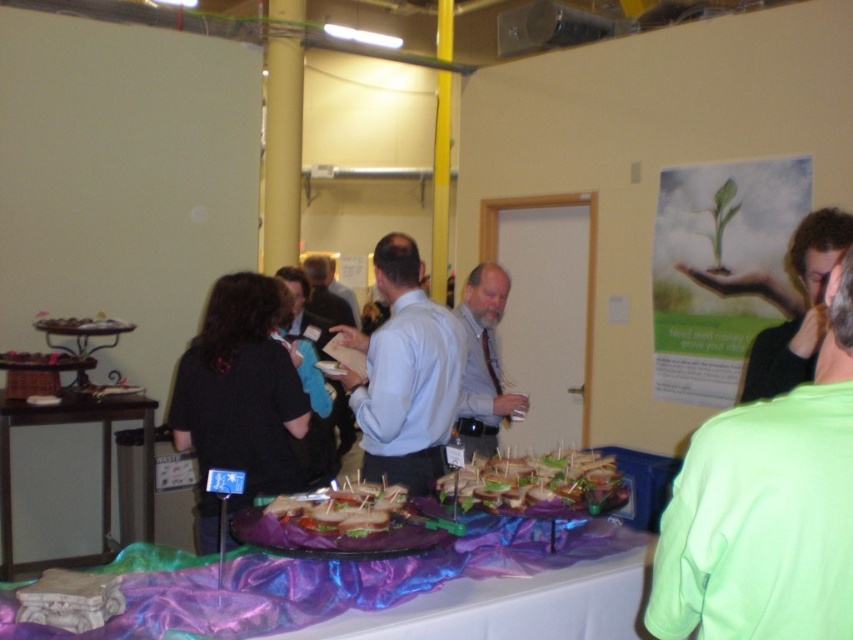
Is green leafy sandwich at center below black shirt at upper right?

Indeed, green leafy sandwich at center is positioned under black shirt at upper right.

The width and height of the screenshot is (853, 640). What do you see at coordinates (537, 484) in the screenshot?
I see `green leafy sandwich at center` at bounding box center [537, 484].

The width and height of the screenshot is (853, 640). Find the location of `green leafy sandwich at center`. green leafy sandwich at center is located at coordinates (537, 484).

Is light blue shirt at center thinner than green leafy sandwich at center?

No.

Does light blue shirt at center have a larger size compared to green leafy sandwich at center?

Correct, light blue shirt at center is larger in size than green leafy sandwich at center.

At what (x,y) coordinates should I click in order to perform the action: click on light blue shirt at center. Please return your answer as a coordinate pair (x, y). Image resolution: width=853 pixels, height=640 pixels. Looking at the image, I should click on (404, 374).

Is white glossy table at lower left shorter than matte brown bread at center?

In fact, white glossy table at lower left may be taller than matte brown bread at center.

Is point (148, 461) more distant than point (374, 499)?

Yes.

Image resolution: width=853 pixels, height=640 pixels. What are the coordinates of `white glossy table at lower left` in the screenshot? It's located at (100, 461).